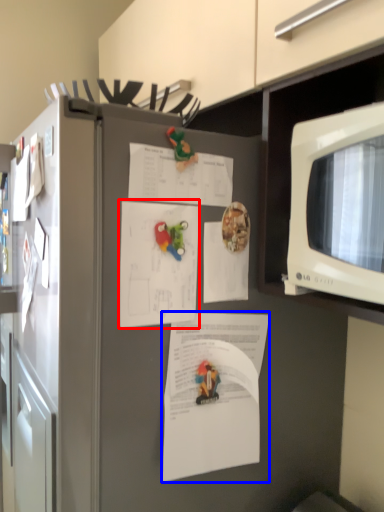
Question: Which object is further to the camera taking this photo, document (highlighted by a red box) or document (highlighted by a blue box)?

Choices:
 (A) document
 (B) document

Answer: (A)